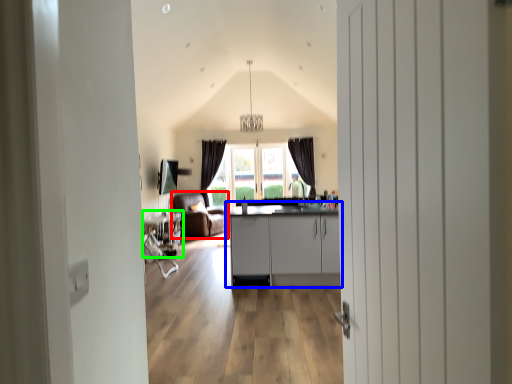
Question: Considering the real-world distances, which object is closest to armchair (highlighted by a red box)? cabinetry (highlighted by a blue box) or table (highlighted by a green box).

Choices:
 (A) cabinetry
 (B) table

Answer: (B)